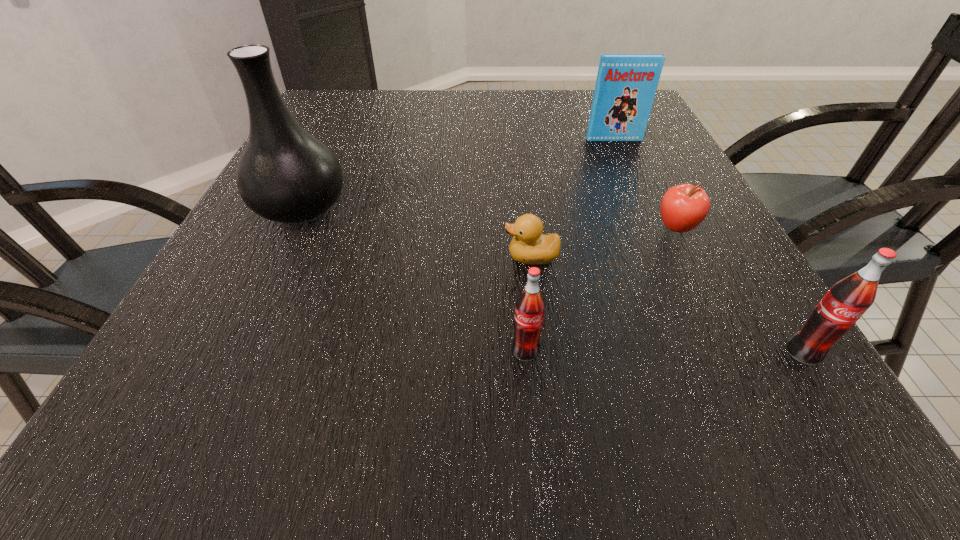
Locate an element on the screen. This screenshot has height=540, width=960. vacant region at the far edge of the desktop is located at coordinates (438, 93).

I want to click on free region at the near edge of the desktop, so click(x=351, y=333).

The height and width of the screenshot is (540, 960). In the image, there is a desktop. What are the coordinates of `vacant space at the left edge` in the screenshot? It's located at (277, 237).

Locate an element on the screen. This screenshot has width=960, height=540. vacant space at the right edge of the desktop is located at coordinates (635, 157).

Locate an element on the screen. free space between the farthest object and the left soda bottle is located at coordinates (569, 245).

You are a GUI agent. You are given a task and a screenshot of the screen. Output one action in this format:
    pyautogui.click(x=<x>, y=<y>)
    Task: Click on the vacant region between the leftmost object and the farthest object
    
    Given the screenshot: What is the action you would take?
    pyautogui.click(x=458, y=173)

The image size is (960, 540). I want to click on unoccupied position between the book and the vase, so click(458, 173).

Where is `free point between the apple and the vase`? free point between the apple and the vase is located at coordinates (489, 217).

Identify the location of vacant space that is in between the right soda bottle and the tallest object. This screenshot has height=540, width=960. (552, 280).

The image size is (960, 540). Identify the location of vacant area that lies between the leftmost object and the fourth farthest object. click(416, 232).